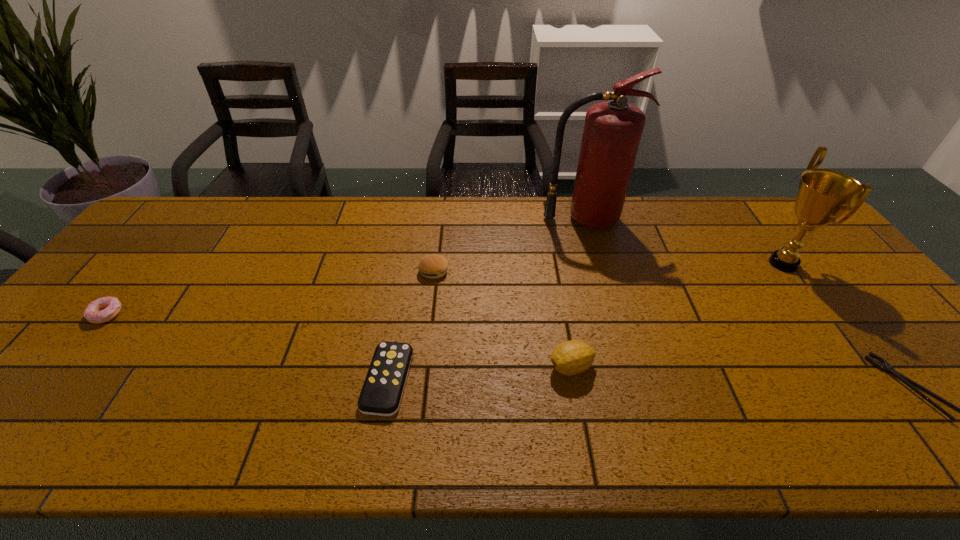
Identify the location of the farthest object. Image resolution: width=960 pixels, height=540 pixels. (612, 132).

At what (x,y) coordinates should I click in order to perform the action: click on fire extinguisher. Please return your answer as a coordinate pair (x, y). The image size is (960, 540). Looking at the image, I should click on (612, 132).

Where is `the sixth shortest object`? Image resolution: width=960 pixels, height=540 pixels. the sixth shortest object is located at coordinates (823, 195).

The image size is (960, 540). Identify the location of the third tallest object. (572, 357).

The width and height of the screenshot is (960, 540). I want to click on the fourth shortest object, so click(433, 266).

This screenshot has height=540, width=960. Find the location of `the fourth farthest object`. the fourth farthest object is located at coordinates (104, 309).

Where is `doughnut`? This screenshot has height=540, width=960. doughnut is located at coordinates (104, 309).

Image resolution: width=960 pixels, height=540 pixels. I want to click on the sixth tallest object, so click(x=382, y=391).

The width and height of the screenshot is (960, 540). Find the location of `vacant area situated 0.070m at the front of the tallest object where the nozzle is aimed`. vacant area situated 0.070m at the front of the tallest object where the nozzle is aimed is located at coordinates (593, 248).

Find the location of `vacant space located 0.330m on the front view with handles of the sixth shortest object`. vacant space located 0.330m on the front view with handles of the sixth shortest object is located at coordinates (648, 264).